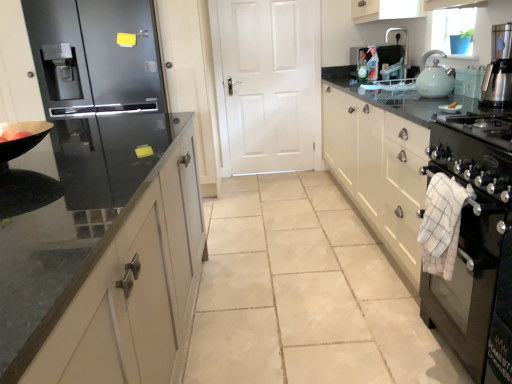
This screenshot has width=512, height=384. What are the coordinates of `satin silver coffee maker at upper right, which appears as the first kitchen appliance when viewed from the front` in the screenshot? It's located at (499, 68).

What is the approximate width of glossy black refrigerator at left?

It is 32.26 inches.

The width and height of the screenshot is (512, 384). I want to click on black glossy countertop at right, so click(x=423, y=211).

The height and width of the screenshot is (384, 512). In order to click on matte orange tomato at left in this screenshot , I will do `click(13, 135)`.

Who is smaller, matte orange tomato at left or white checkered towel at right?

matte orange tomato at left.

Is matte orange tomato at left oriented towards white checkered towel at right?

Yes, matte orange tomato at left is aimed at white checkered towel at right.

Which is less distant, (x=26, y=131) or (x=435, y=187)?

The point (x=435, y=187) is closer to the camera.

Is matte orange tomato at left located outside white checkered towel at right?

Indeed, matte orange tomato at left is completely outside white checkered towel at right.

From a real-world perspective, is glossy black refrigerator at left positioned over black glossy countertop at right based on gravity?

Yes, from a real-world perspective, glossy black refrigerator at left is above black glossy countertop at right.

Is black glossy countertop at right located within glossy black refrigerator at left?

No, glossy black refrigerator at left does not contain black glossy countertop at right.

From the image's perspective, who appears lower, glossy black refrigerator at left or black glossy countertop at right?

black glossy countertop at right is shown below in the image.

Between glossy black refrigerator at left and black glossy countertop at right, which one has less height?

black glossy countertop at right.

Between silver metallic faucet at upper right and blue plastic window screen at upper right, which one has less height?

Standing shorter between the two is blue plastic window screen at upper right.

How distant is silver metallic faucet at upper right from blue plastic window screen at upper right?

silver metallic faucet at upper right is 17.72 inches away from blue plastic window screen at upper right.

Is silver metallic faucet at upper right located outside blue plastic window screen at upper right?

Absolutely, silver metallic faucet at upper right is external to blue plastic window screen at upper right.

The image size is (512, 384). In order to click on window screen that appears in front of the silver metallic faucet at upper right in this screenshot , I will do point(454,31).

Which is more distant, [434,54] or [492,371]?

The point [434,54] is farther from the camera.

How many degrees apart are the facing directions of light blue ceramic kettle at upper right, the 2th kitchen appliance in the front-to-back sequence, and black glass stove at right?

0.388 degrees.

Is light blue ceramic kettle at upper right, acting as the 1th kitchen appliance starting from the back, at the right side of black glass stove at right?

Yes.

From the image's perspective, is light blue ceramic kettle at upper right, acting as the 1th kitchen appliance starting from the back, beneath black glass stove at right?

No.

Who is bigger, glossy black refrigerator at left or silver metallic faucet at upper right?

Bigger between the two is glossy black refrigerator at left.

Considering the sizes of objects glossy black refrigerator at left and silver metallic faucet at upper right in the image provided, who is wider, glossy black refrigerator at left or silver metallic faucet at upper right?

With larger width is glossy black refrigerator at left.

How far apart are glossy black refrigerator at left and silver metallic faucet at upper right?

A: glossy black refrigerator at left and silver metallic faucet at upper right are 7.31 feet apart from each other.

Which point is more forward, (121, 28) or (405, 66)?

The point (121, 28) is more forward.

Considering the relative sizes of white checkered towel at right and matte orange tomato at left in the image provided, is white checkered towel at right bigger than matte orange tomato at left?

Yes, white checkered towel at right is bigger than matte orange tomato at left.

Would you say white checkered towel at right contains matte orange tomato at left?

No.

This screenshot has height=384, width=512. I want to click on food behind the white checkered towel at right, so click(x=13, y=135).

Considering the relative positions of white checkered towel at right and matte orange tomato at left in the image provided, is white checkered towel at right to the right of matte orange tomato at left from the viewer's perspective?

Yes.

What's the angular difference between silver metallic faucet at upper right and white matte door at center's facing directions?

The facing directions of silver metallic faucet at upper right and white matte door at center are 58.2 degrees apart.

Does silver metallic faucet at upper right have a lesser width compared to white matte door at center?

No, silver metallic faucet at upper right is not thinner than white matte door at center.

Does silver metallic faucet at upper right turn towards white matte door at center?

No, silver metallic faucet at upper right is not turned towards white matte door at center.

Considering their positions, is silver metallic faucet at upper right located in front of or behind white matte door at center?

Clearly, silver metallic faucet at upper right is in front of white matte door at center.

In order to click on food on the left side of white checkered towel at right in this screenshot , I will do `click(13, 135)`.

Find the location of a particular element. The height and width of the screenshot is (384, 512). countertop that is on the right side of glossy black refrigerator at left is located at coordinates (423, 211).

Considering their positions, is satin silver coffee maker at upper right, which appears as the first kitchen appliance when viewed from the front, positioned closer to white matte door at center than blue plastic window screen at upper right?

blue plastic window screen at upper right.

Looking at the image, which one is located further to glossy black refrigerator at left, matte orange tomato at left or satin silver coffee maker at upper right, which appears as the first kitchen appliance when viewed from the front?

The object further to glossy black refrigerator at left is satin silver coffee maker at upper right, which appears as the first kitchen appliance when viewed from the front.

When comparing their distances from black glossy countertop at right, does matte orange tomato at left or glossy black refrigerator at left seem further?

Based on the image, matte orange tomato at left appears to be further to black glossy countertop at right.

Estimate the real-world distances between objects in this image. Which object is closer to glossy black refrigerator at left, white matte door at center or blue plastic window screen at upper right?

white matte door at center.

Considering their positions, is blue plastic window screen at upper right positioned closer to satin silver coffee maker at upper right, the 2th kitchen appliance viewed from the back, than black glass stove at right?

black glass stove at right.

Considering their positions, is light blue ceramic kettle at upper right, acting as the 1th kitchen appliance starting from the back, positioned closer to white checkered towel at right than satin silver coffee maker at upper right, the 2th kitchen appliance viewed from the back?

satin silver coffee maker at upper right, the 2th kitchen appliance viewed from the back, is closer to white checkered towel at right.

Based on the photo, estimate the real-world distances between objects in this image. Which object is further from satin silver coffee maker at upper right, the 2th kitchen appliance viewed from the back, white matte door at center or black glass stove at right?

white matte door at center.

Which object lies further to the anchor point light blue ceramic kettle at upper right, acting as the 1th kitchen appliance starting from the back, glossy black refrigerator at left or blue plastic window screen at upper right?

Among the two, glossy black refrigerator at left is located further to light blue ceramic kettle at upper right, acting as the 1th kitchen appliance starting from the back.

This screenshot has height=384, width=512. In order to click on window screen between black glass stove at right and white matte door at center in the front-back direction in this screenshot , I will do `click(454, 31)`.

You are a GUI agent. You are given a task and a screenshot of the screen. Output one action in this format:
    pyautogui.click(x=<x>, y=<y>)
    Task: Click on the door situated between glossy black refrigerator at left and silver metallic faucet at upper right from left to right
    The height and width of the screenshot is (384, 512).
    Given the screenshot: What is the action you would take?
    pyautogui.click(x=267, y=83)

Locate an element on the screen. This screenshot has width=512, height=384. cloth situated between matte orange tomato at left and silver metallic faucet at upper right from left to right is located at coordinates click(442, 224).

The height and width of the screenshot is (384, 512). In order to click on home appliance located between glossy black refrigerator at left and silver metallic faucet at upper right in the left-right direction in this screenshot , I will do `click(476, 244)`.